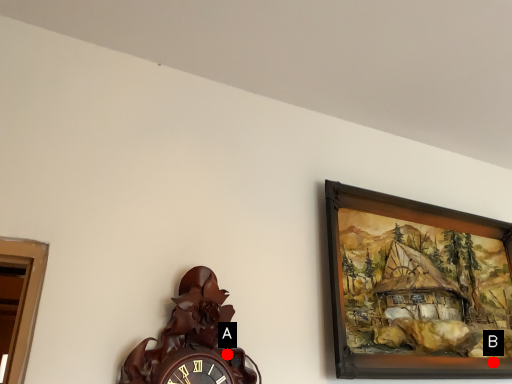
Question: Two points are circled on the image, labeled by A and B beside each circle. Among these points, which one is nearest to the camera?

Choices:
 (A) A is closer
 (B) B is closer

Answer: (A)